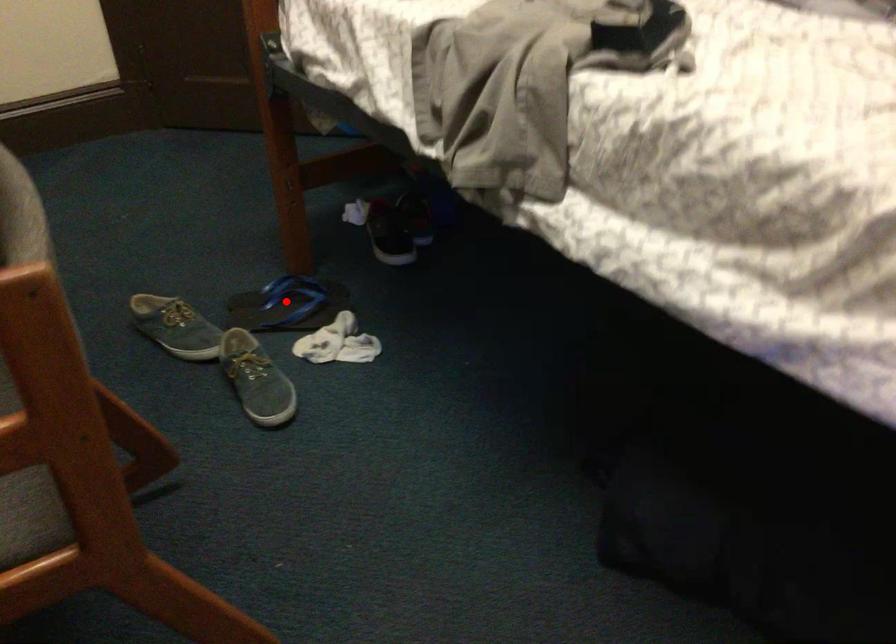
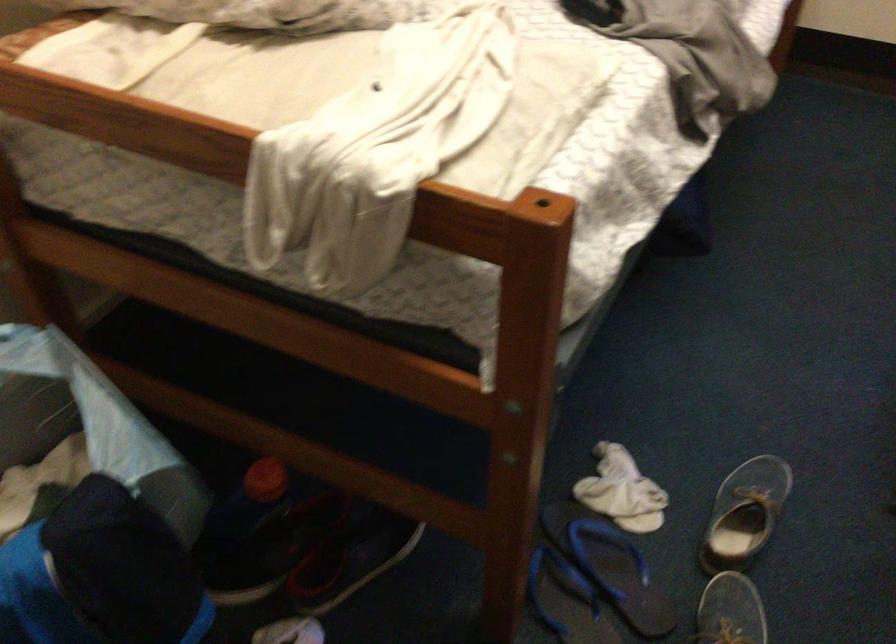
Question: I am providing you with two images of the same scene from different viewpoints. A red point is shown in image1. For the corresponding object point in image2, is it positioned nearer or farther from the camera?

Choices:
 (A) Nearer
 (B) Farther

Answer: (A)